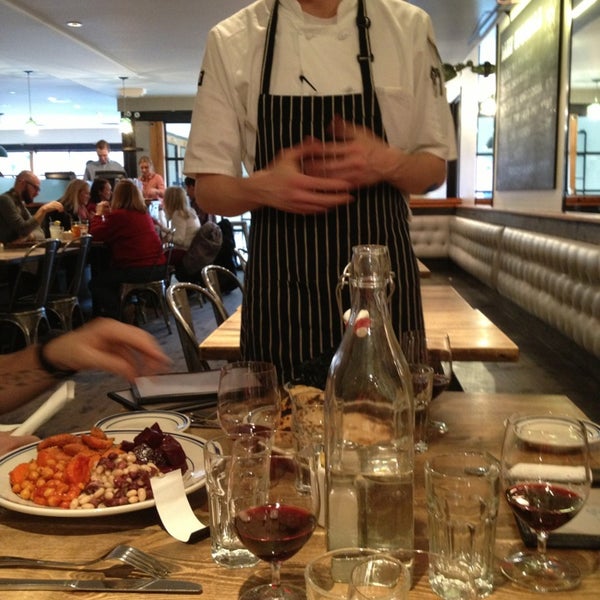
You are a GUI agent. You are given a task and a screenshot of the screen. Output one action in this format:
    pyautogui.click(x=<x>, y=<y>)
    Task: Click on the white saucer
    The height and width of the screenshot is (600, 600).
    Given the screenshot: What is the action you would take?
    pyautogui.click(x=551, y=425), pyautogui.click(x=165, y=419)